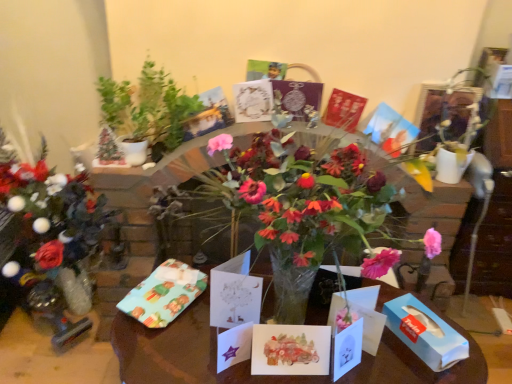
This screenshot has height=384, width=512. What are the coordinates of `blank area to the left of watercolor paper card at center, marked as the 4th birthday card in a back-to-front arrangement` in the screenshot? It's located at (203, 354).